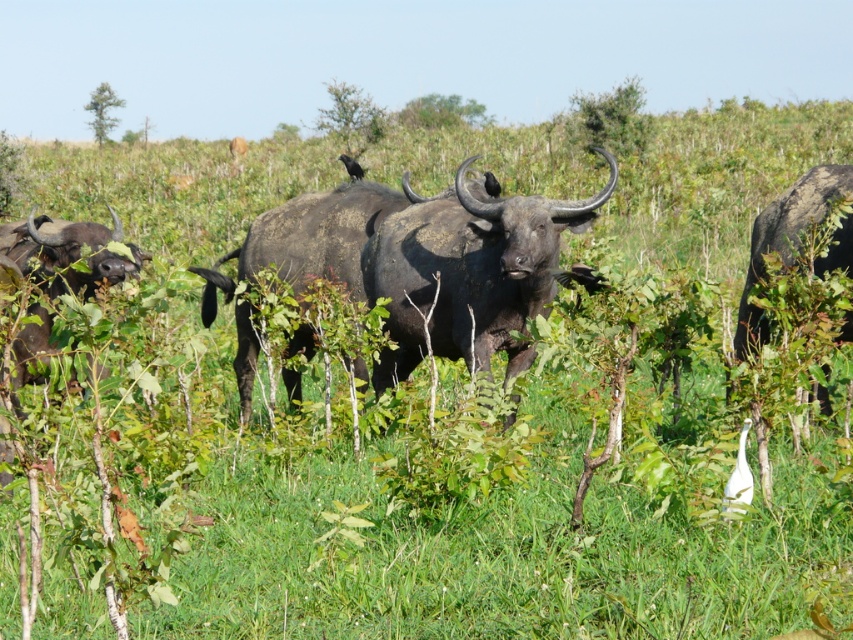
You are a wildlife photographer aiming to capture the largest animal in the scene. Which one should you focus on between the black matte yak at center and the dark brown horned bull at right?

The black matte yak at center is larger in size compared to the dark brown horned bull at right, so you should focus on the black matte yak at center to capture the largest animal in the scene.

You are a photographer trying to capture a clear shot of the black matte yak at center and the dark brown horned bull at right. Based on their positions, which animal is positioned higher in the frame?

The black matte yak at center is positioned higher in the frame than the dark brown horned bull at right because it is located above it.

You are a wildlife photographer trying to capture a photo of the shiny dark brown bull at center and the black matte yak at center. From your current position, which animal is positioned to your left?

The black matte yak at center is to the left of the shiny dark brown bull at center, so the black matte yak at center would be on your left side.